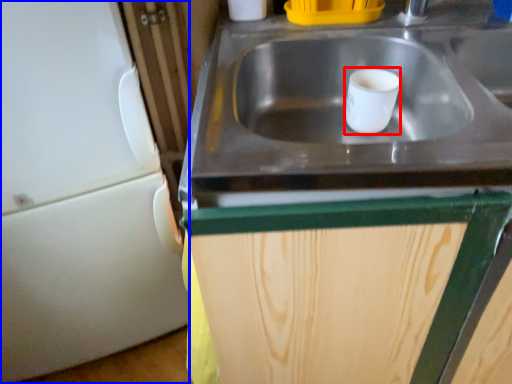
Question: Which of the following is the closest to the observer, mug (highlighted by a red box) or appliance (highlighted by a blue box)?

Choices:
 (A) mug
 (B) appliance

Answer: (B)